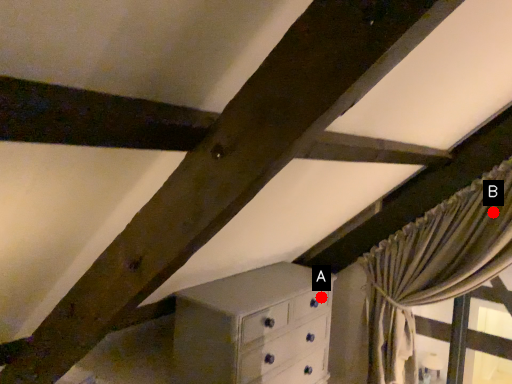
Question: Two points are circled on the image, labeled by A and B beside each circle. Which point is farther to the camera?

Choices:
 (A) A is further
 (B) B is further

Answer: (A)